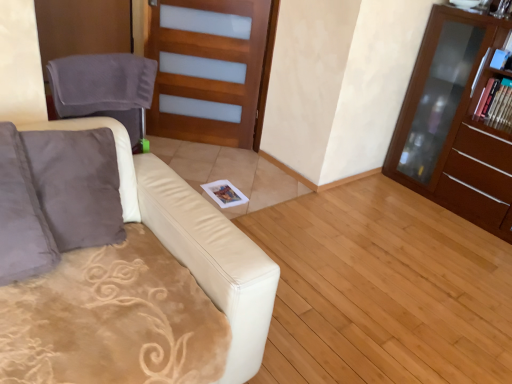
Question: Is wooden frosted glass door at center inside the boundaries of brown wood cabinet at right, or outside?

Choices:
 (A) inside
 (B) outside

Answer: (B)

Question: In terms of height, does wooden frosted glass door at center look taller or shorter compared to brown wood cabinet at right?

Choices:
 (A) tall
 (B) short

Answer: (B)

Question: Which object is positioned farthest from the light brown wood at center?

Choices:
 (A) blue glossy book at upper right
 (B) brown wood cabinet at right
 (C) matte cardboard magazine at upper right
 (D) gray fabric swivel chair at left
 (E) wooden frosted glass door at center

Answer: (A)

Question: Estimate the real-world distances between objects in this image. Which object is farther from the brown wood cabinet at right?

Choices:
 (A) light brown wood at center
 (B) wooden frosted glass door at center
 (C) matte cardboard magazine at upper right
 (D) blue glossy book at upper right
 (E) gray fabric swivel chair at left

Answer: (E)